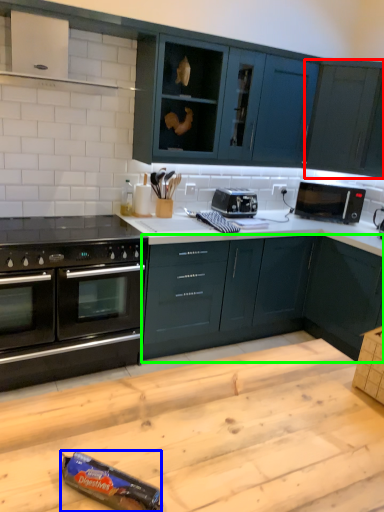
Question: Which object is the closest to the cabinetry (highlighted by a red box)? Choose among these: appliance (highlighted by a blue box) or cabinetry (highlighted by a green box).

Choices:
 (A) appliance
 (B) cabinetry

Answer: (B)